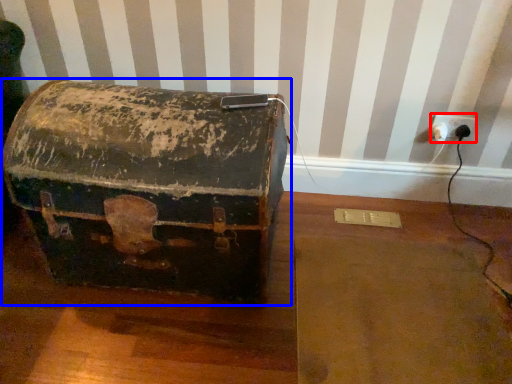
Question: Among these objects, which one is farthest to the camera, electric outlet (highlighted by a red box) or box (highlighted by a blue box)?

Choices:
 (A) electric outlet
 (B) box

Answer: (A)